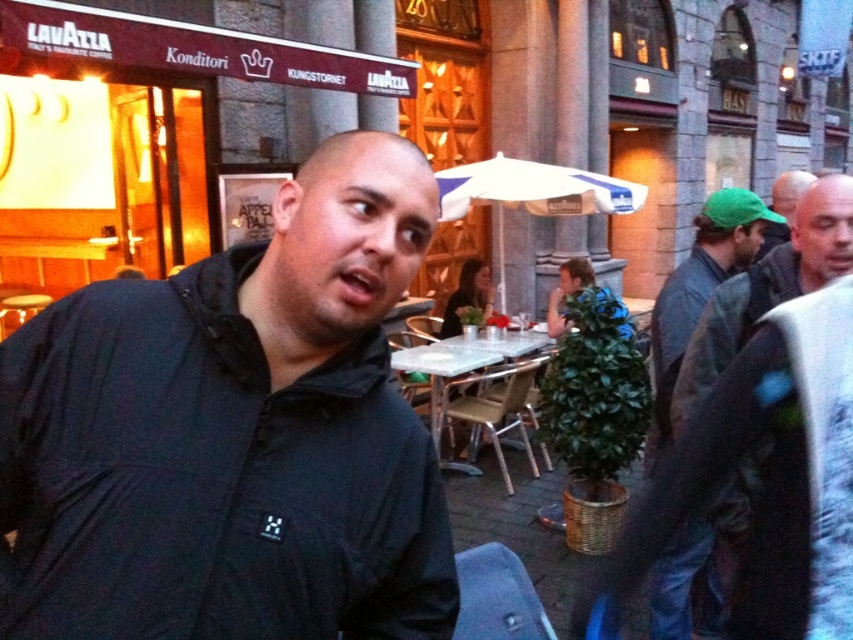
You are a customer at the cafe and want to sit under the white fabric umbrella at center. There is a green fabric cap at upper right nearby. Which object is closer to your desired seating area?

The white fabric umbrella at center is closer to your desired seating area because it is the one you want to sit under, while the green fabric cap at upper right is positioned to its left side.

You are a delivery person trying to navigate through the crowd in the image. The black matte jacket at center and the white fabric umbrella at center are in your path. Which object is narrower and easier to pass by without touching?

The black matte jacket at center is thinner than the white fabric umbrella at center, so it is narrower and easier to pass by without touching.